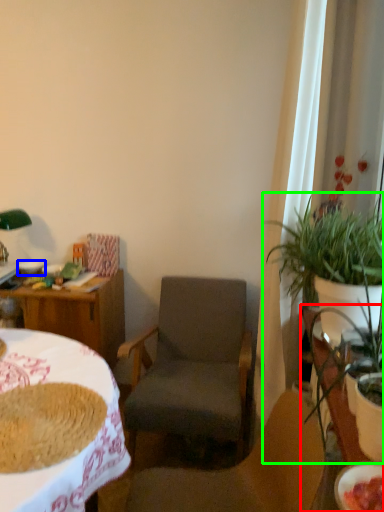
Question: Considering the real-world distances, which object is closest to table (highlighted by a red box)? bowl (highlighted by a blue box) or houseplant (highlighted by a green box).

Choices:
 (A) bowl
 (B) houseplant

Answer: (B)